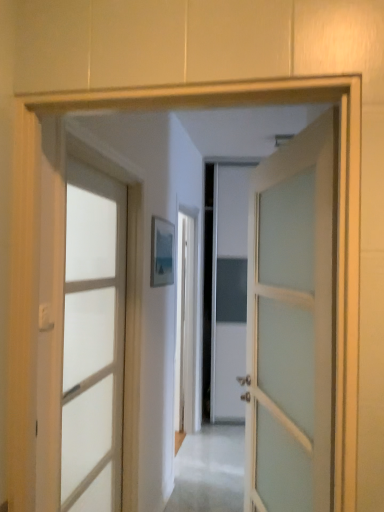
In order to face satin white door at center, the 1th door when ordered from right to left, should I rotate leftwards or rightwards?

Rotate your view right by about 12.430°.

Describe the element at coordinates (292, 324) in the screenshot. I see `satin white door at center, the 1th door when ordered from right to left` at that location.

Locate an element on the screen. This screenshot has height=512, width=384. satin white door at center, the 1th door when ordered from right to left is located at coordinates (292, 324).

In order to click on clear glass door at left, the 1th door positioned from the left in this screenshot , I will do `click(93, 341)`.

Image resolution: width=384 pixels, height=512 pixels. What do you see at coordinates (93, 341) in the screenshot? I see `clear glass door at left, the 1th door positioned from the left` at bounding box center [93, 341].

Find the location of `satin white door at center, the 1th door when ordered from right to left`. satin white door at center, the 1th door when ordered from right to left is located at coordinates (292, 324).

Does clear glass door at left, placed as the second door when sorted from right to left, appear on the left side of satin white door at center, the 1th door when ordered from right to left?

Yes, clear glass door at left, placed as the second door when sorted from right to left, is to the left of satin white door at center, the 1th door when ordered from right to left.

Which is in front, clear glass door at left, placed as the second door when sorted from right to left, or satin white door at center, the 1th door when ordered from right to left?

satin white door at center, the 1th door when ordered from right to left.

Consider the image. Which is nearer, (93, 445) or (300, 241)?

The point (300, 241) is closer to the camera.

In the scene shown: From the image's perspective, which is above, clear glass door at left, placed as the second door when sorted from right to left, or satin white door at center, the 1th door when ordered from right to left?

satin white door at center, the 1th door when ordered from right to left, appears higher in the image.

From a real-world perspective, which is physically below, clear glass door at left, placed as the second door when sorted from right to left, or satin white door at center, which appears as the second door when viewed from the left?

From a 3D spatial view, clear glass door at left, placed as the second door when sorted from right to left, is below.

Considering the sizes of objects clear glass door at left, placed as the second door when sorted from right to left, and satin white door at center, which appears as the second door when viewed from the left, in the image provided, who is thinner, clear glass door at left, placed as the second door when sorted from right to left, or satin white door at center, which appears as the second door when viewed from the left,?

clear glass door at left, placed as the second door when sorted from right to left, is thinner.

Who is taller, clear glass door at left, placed as the second door when sorted from right to left, or satin white door at center, which appears as the second door when viewed from the left?

Standing taller between the two is clear glass door at left, placed as the second door when sorted from right to left.

Considering the sizes of objects clear glass door at left, the 1th door positioned from the left, and satin white door at center, which appears as the second door when viewed from the left, in the image provided, who is bigger, clear glass door at left, the 1th door positioned from the left, or satin white door at center, which appears as the second door when viewed from the left,?

With larger size is satin white door at center, which appears as the second door when viewed from the left.

Do you think clear glass door at left, placed as the second door when sorted from right to left, is within satin white door at center, which appears as the second door when viewed from the left, or outside of it?

clear glass door at left, placed as the second door when sorted from right to left, is located beyond the bounds of satin white door at center, which appears as the second door when viewed from the left.

Are clear glass door at left, placed as the second door when sorted from right to left, and satin white door at center, the 1th door when ordered from right to left, beside each other?

No, clear glass door at left, placed as the second door when sorted from right to left, is not making contact with satin white door at center, the 1th door when ordered from right to left.

Could you tell me if clear glass door at left, the 1th door positioned from the left, is turned towards satin white door at center, the 1th door when ordered from right to left?

Yes, clear glass door at left, the 1th door positioned from the left, faces towards satin white door at center, the 1th door when ordered from right to left.

Can you tell me how much clear glass door at left, placed as the second door when sorted from right to left, and satin white door at center, the 1th door when ordered from right to left, differ in facing direction?

The angle between the facing direction of clear glass door at left, placed as the second door when sorted from right to left, and the facing direction of satin white door at center, the 1th door when ordered from right to left, is 162 degrees.

The height and width of the screenshot is (512, 384). I want to click on door above the clear glass door at left, the 1th door positioned from the left (from a real-world perspective), so pyautogui.click(x=292, y=324).

Is satin white door at center, the 1th door when ordered from right to left, to the right of clear glass door at left, the 1th door positioned from the left, from the viewer's perspective?

Yes, satin white door at center, the 1th door when ordered from right to left, is to the right of clear glass door at left, the 1th door positioned from the left.

Which is in front, satin white door at center, which appears as the second door when viewed from the left, or clear glass door at left, the 1th door positioned from the left?

satin white door at center, which appears as the second door when viewed from the left.

Considering the points (290, 367) and (85, 343), which point is behind, point (290, 367) or point (85, 343)?

The point (85, 343) is farther.

From the image's perspective, is satin white door at center, the 1th door when ordered from right to left, over clear glass door at left, placed as the second door when sorted from right to left?

Yes, from the image's perspective, satin white door at center, the 1th door when ordered from right to left, is above clear glass door at left, placed as the second door when sorted from right to left.

From a real-world perspective, is satin white door at center, the 1th door when ordered from right to left, physically above clear glass door at left, the 1th door positioned from the left?

Yes, from a real-world perspective, satin white door at center, the 1th door when ordered from right to left, is over clear glass door at left, the 1th door positioned from the left

Considering the sizes of objects satin white door at center, which appears as the second door when viewed from the left, and clear glass door at left, placed as the second door when sorted from right to left, in the image provided, who is thinner, satin white door at center, which appears as the second door when viewed from the left, or clear glass door at left, placed as the second door when sorted from right to left,?

Thinner between the two is clear glass door at left, placed as the second door when sorted from right to left.

Which of these two, satin white door at center, the 1th door when ordered from right to left, or clear glass door at left, the 1th door positioned from the left, stands shorter?

satin white door at center, the 1th door when ordered from right to left, is shorter.

Between satin white door at center, the 1th door when ordered from right to left, and clear glass door at left, placed as the second door when sorted from right to left, which one has smaller size?

clear glass door at left, placed as the second door when sorted from right to left, is smaller.

Is satin white door at center, the 1th door when ordered from right to left, completely or partially outside of clear glass door at left, placed as the second door when sorted from right to left?

Indeed, satin white door at center, the 1th door when ordered from right to left, is completely outside clear glass door at left, placed as the second door when sorted from right to left.

Can you see satin white door at center, the 1th door when ordered from right to left, touching clear glass door at left, the 1th door positioned from the left?

No, satin white door at center, the 1th door when ordered from right to left, is not beside clear glass door at left, the 1th door positioned from the left.

Is satin white door at center, the 1th door when ordered from right to left, oriented away from clear glass door at left, the 1th door positioned from the left?

satin white door at center, the 1th door when ordered from right to left, does not have its back to clear glass door at left, the 1th door positioned from the left.

How distant is satin white door at center, the 1th door when ordered from right to left, from clear glass door at left, placed as the second door when sorted from right to left?

satin white door at center, the 1th door when ordered from right to left, and clear glass door at left, placed as the second door when sorted from right to left, are 30.30 inches apart from each other.

The width and height of the screenshot is (384, 512). Identify the location of door that is below the satin white door at center, the 1th door when ordered from right to left (from the image's perspective). (93, 341).

The height and width of the screenshot is (512, 384). I want to click on door above the clear glass door at left, placed as the second door when sorted from right to left (from the image's perspective), so click(292, 324).

Identify the location of door that appears below the satin white door at center, the 1th door when ordered from right to left (from the image's perspective). (93, 341).